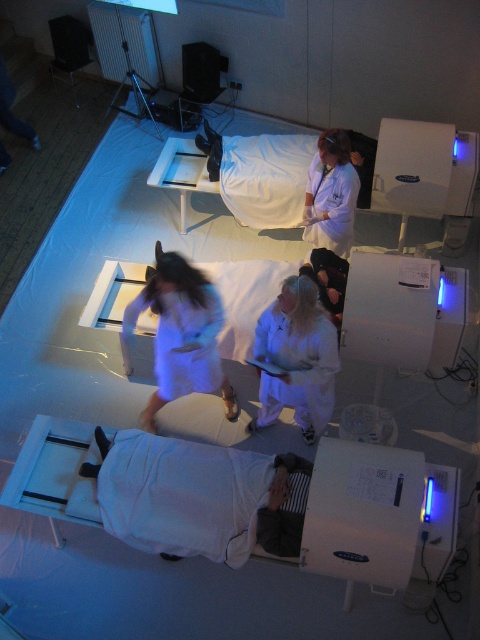
Question: Which point is farther from the camera taking this photo?

Choices:
 (A) (263, 380)
 (B) (324, 172)

Answer: (B)

Question: Which object is farther from the camera taking this photo?

Choices:
 (A) white fluffy bathrobe at center
 (B) white matte/soft robe at lower center
 (C) white matte/soft robe at center
 (D) white matte lab coat at upper center

Answer: (D)

Question: Can you confirm if white fabric bed at center is smaller than white matte lab coat at upper center?

Choices:
 (A) yes
 (B) no

Answer: (B)

Question: Does white matte/soft robe at center appear over white matte lab coat at upper center?

Choices:
 (A) no
 (B) yes

Answer: (A)

Question: Can you confirm if white fluffy bathrobe at center is positioned above white fabric bed at center?

Choices:
 (A) no
 (B) yes

Answer: (A)

Question: Which of the following is the farthest from the observer?

Choices:
 (A) white fabric bed at center
 (B) white fluffy bathrobe at center
 (C) white matte/soft robe at lower center

Answer: (A)